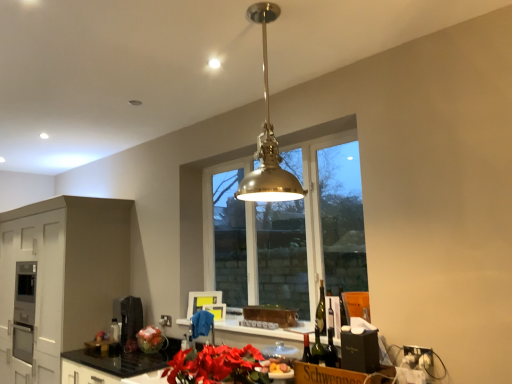
Question: Is matte black coffee machine at lower left, which is the first appliance in back-to-front order, not inside white matte cabinetry at lower left?

Choices:
 (A) no
 (B) yes

Answer: (B)

Question: Can you confirm if matte black coffee machine at lower left, the first appliance viewed from the left, is smaller than white matte cabinetry at lower left?

Choices:
 (A) yes
 (B) no

Answer: (A)

Question: Does matte black coffee machine at lower left, marked as the 2th appliance in a right-to-left arrangement, have a lesser width compared to white matte cabinetry at lower left?

Choices:
 (A) no
 (B) yes

Answer: (B)

Question: Is matte black coffee machine at lower left, marked as the 2th appliance in a right-to-left arrangement, in front of white matte cabinetry at lower left?

Choices:
 (A) yes
 (B) no

Answer: (B)

Question: Is matte black coffee machine at lower left, which appears as the second appliance when viewed from the front, positioned far away from white matte cabinetry at lower left?

Choices:
 (A) yes
 (B) no

Answer: (B)

Question: Would you say black granite countertop at lower center, which is the second countertop from left to right, is inside or outside metallic silver toaster at center, which is counted as the 1th appliance, starting from the front?

Choices:
 (A) outside
 (B) inside

Answer: (A)

Question: Is black granite countertop at lower center, which is the second countertop from left to right, taller or shorter than metallic silver toaster at center, positioned as the 2th appliance in left-to-right order?

Choices:
 (A) tall
 (B) short

Answer: (A)

Question: Relative to metallic silver toaster at center, which is counted as the 1th appliance, starting from the front, is black granite countertop at lower center, which is the second countertop from left to right, in front or behind?

Choices:
 (A) front
 (B) behind

Answer: (A)

Question: In terms of size, does black granite countertop at lower center, placed as the first countertop when sorted from right to left, appear bigger or smaller than metallic silver toaster at center, positioned as the 2th appliance in left-to-right order?

Choices:
 (A) small
 (B) big

Answer: (B)

Question: Do you think black granite countertop at lower center, arranged as the 1th countertop when viewed from the left, is within black granite countertop at lower center, placed as the first countertop when sorted from right to left, or outside of it?

Choices:
 (A) outside
 (B) inside

Answer: (B)

Question: Considering the positions of black granite countertop at lower center, arranged as the 1th countertop when viewed from the left, and black granite countertop at lower center, placed as the first countertop when sorted from right to left, in the image, is black granite countertop at lower center, arranged as the 1th countertop when viewed from the left, bigger or smaller than black granite countertop at lower center, placed as the first countertop when sorted from right to left,?

Choices:
 (A) small
 (B) big

Answer: (A)

Question: From the image's perspective, is black granite countertop at lower center, arranged as the 1th countertop when viewed from the left, positioned above or below black granite countertop at lower center, which is the second countertop from left to right?

Choices:
 (A) above
 (B) below

Answer: (B)

Question: In terms of height, does black granite countertop at lower center, arranged as the 1th countertop when viewed from the left, look taller or shorter compared to black granite countertop at lower center, which is the second countertop from left to right?

Choices:
 (A) tall
 (B) short

Answer: (B)

Question: From the image's perspective, is matte black coffee machine at lower left, marked as the 2th appliance in a right-to-left arrangement, located above or below brass/polished metal pendant light at center?

Choices:
 (A) above
 (B) below

Answer: (B)

Question: Considering the positions of matte black coffee machine at lower left, which appears as the second appliance when viewed from the front, and brass/polished metal pendant light at center in the image, is matte black coffee machine at lower left, which appears as the second appliance when viewed from the front, taller or shorter than brass/polished metal pendant light at center?

Choices:
 (A) tall
 (B) short

Answer: (B)